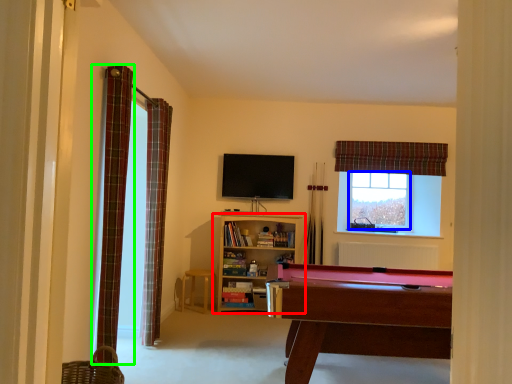
Question: Which is farther away from shelf (highlighted by a red box)? window screen (highlighted by a blue box) or curtain (highlighted by a green box)?

Choices:
 (A) window screen
 (B) curtain

Answer: (B)